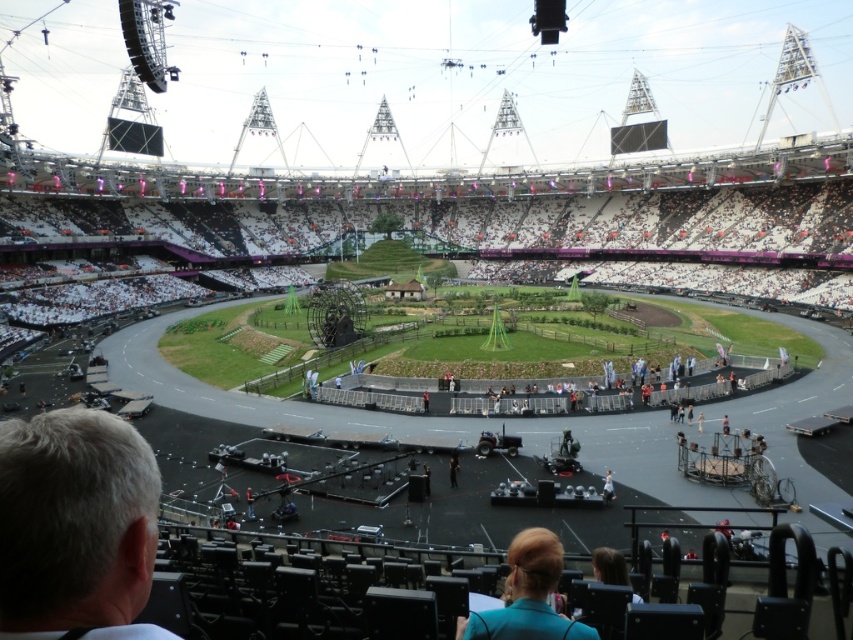
You are standing at the edge of the stadium and see the green grass at center and the dark blue fabric at center. Which one is located to the left when facing the center?

The green grass at center is positioned on the left side of dark blue fabric at center, so when facing the center, the green grass at center is to the left.

You are a photographer positioned at the back of the stadium, aiming to capture a clear shot of both the gray hair at lower left and the white fabric dress at center. Based on their positions and sizes, which subject might require you to adjust your camera angle to ensure both are fully visible in the frame?

The gray hair at lower left might be wider than the white fabric dress at center, so you may need to adjust your camera angle to accommodate its width to ensure both are fully visible.